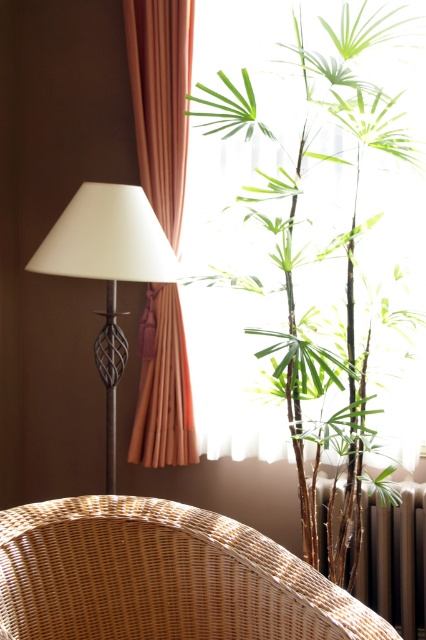
You are a delivery person trying to place a small package between the orange fabric curtain at left and the matte white lamp at left. Can you fit the package if it measures 12 inches in width?

The orange fabric curtain at left is 13.11 inches away from the matte white lamp at left, so yes, the package measuring 12 inches in width can fit between them since the space is wider than the package.